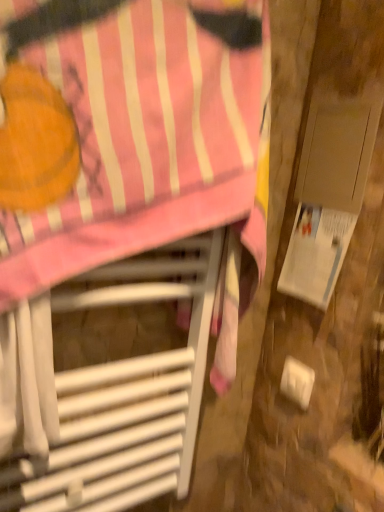
Describe the element at coordinates (120, 227) in the screenshot. The image size is (384, 512). I see `white plastic radiator at left` at that location.

Find the location of a particular element. The image size is (384, 512). white plastic radiator at left is located at coordinates (120, 227).

The image size is (384, 512). Identify the location of white plastic radiator at left. point(120,227).